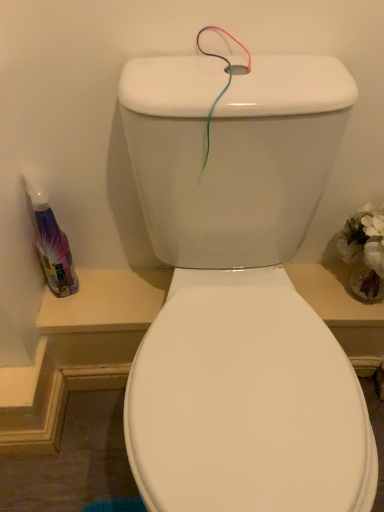
Locate an element on the screen. The width and height of the screenshot is (384, 512). purple glossy spray bottle at left is located at coordinates (51, 243).

Image resolution: width=384 pixels, height=512 pixels. What do you see at coordinates (51, 243) in the screenshot? I see `purple glossy spray bottle at left` at bounding box center [51, 243].

You are a GUI agent. You are given a task and a screenshot of the screen. Output one action in this format:
    pyautogui.click(x=<x>, y=<y>)
    Task: Click on the purple glossy spray bottle at left
    This screenshot has height=512, width=384.
    Given the screenshot: What is the action you would take?
    pyautogui.click(x=51, y=243)